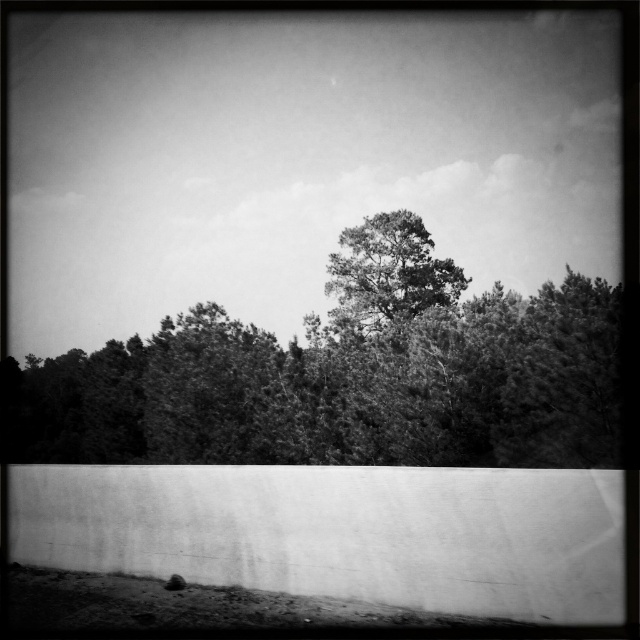
Does dark green textured tree at center have a greater height compared to grainy black tree at center?

Yes, dark green textured tree at center is taller than grainy black tree at center.

Who is more distant from viewer, [378,339] or [356,250]?

The point [356,250] is more distant.

Locate an element on the screen. This screenshot has height=640, width=640. dark green textured tree at center is located at coordinates (344, 376).